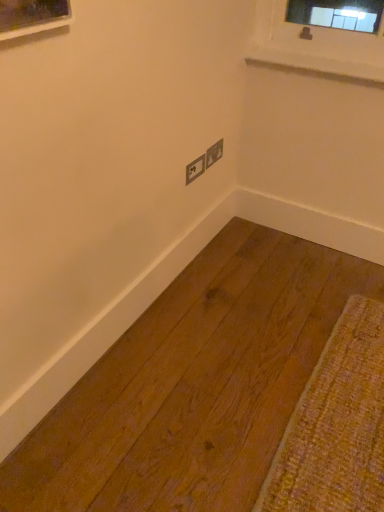
Question: From a real-world perspective, is matte gray electrical outlet at center, acting as the second electric outlet starting from the left, physically above matte gray electric outlet at center, arranged as the second electric outlet when viewed from the right?

Choices:
 (A) yes
 (B) no

Answer: (A)

Question: Is matte gray electrical outlet at center, acting as the second electric outlet starting from the left, beside matte gray electric outlet at center, the 1th electric outlet from the left?

Choices:
 (A) yes
 (B) no

Answer: (A)

Question: Is matte gray electrical outlet at center, acting as the second electric outlet starting from the left, oriented away from matte gray electric outlet at center, arranged as the second electric outlet when viewed from the right?

Choices:
 (A) no
 (B) yes

Answer: (A)

Question: From the image's perspective, is matte gray electrical outlet at center, the first electric outlet positioned from the right, on top of matte gray electric outlet at center, the 1th electric outlet from the left?

Choices:
 (A) no
 (B) yes

Answer: (B)

Question: From a real-world perspective, is matte gray electrical outlet at center, acting as the second electric outlet starting from the left, positioned under matte gray electric outlet at center, the 1th electric outlet from the left, based on gravity?

Choices:
 (A) no
 (B) yes

Answer: (A)

Question: Is matte gray electrical outlet at center, the first electric outlet positioned from the right, thinner than matte gray electric outlet at center, the 1th electric outlet from the left?

Choices:
 (A) yes
 (B) no

Answer: (A)

Question: Is white smooth window sill at upper right aimed at matte gray electric outlet at center, the 1th electric outlet from the left?

Choices:
 (A) no
 (B) yes

Answer: (A)

Question: Considering the relative positions of white smooth window sill at upper right and matte gray electric outlet at center, the 1th electric outlet from the left, in the image provided, is white smooth window sill at upper right behind matte gray electric outlet at center, the 1th electric outlet from the left,?

Choices:
 (A) yes
 (B) no

Answer: (B)

Question: Is white smooth window sill at upper right smaller than matte gray electric outlet at center, the 1th electric outlet from the left?

Choices:
 (A) no
 (B) yes

Answer: (A)

Question: Does white smooth window sill at upper right have a lesser height compared to matte gray electric outlet at center, arranged as the second electric outlet when viewed from the right?

Choices:
 (A) no
 (B) yes

Answer: (B)

Question: Considering the relative sizes of white smooth window sill at upper right and matte gray electric outlet at center, the 1th electric outlet from the left, in the image provided, is white smooth window sill at upper right thinner than matte gray electric outlet at center, the 1th electric outlet from the left,?

Choices:
 (A) no
 (B) yes

Answer: (A)

Question: From a real-world perspective, is white smooth window sill at upper right on top of matte gray electric outlet at center, the 1th electric outlet from the left?

Choices:
 (A) yes
 (B) no

Answer: (A)

Question: Is matte gray electrical outlet at center, acting as the second electric outlet starting from the left, not within white smooth window sill at upper right?

Choices:
 (A) yes
 (B) no

Answer: (A)